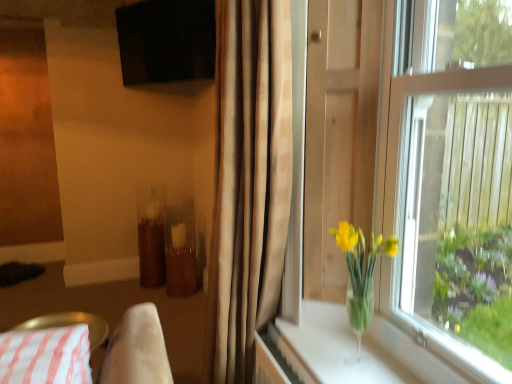
Question: Does black matte screen at upper center, which is the second window screen from bottom to top, have a greater height compared to translucent glass vase at window?

Choices:
 (A) yes
 (B) no

Answer: (A)

Question: From a real-world perspective, is black matte screen at upper center, arranged as the 1th window screen when viewed from the left, over translucent glass vase at window?

Choices:
 (A) no
 (B) yes

Answer: (B)

Question: Is black matte screen at upper center, arranged as the 1th window screen when viewed from the back, positioned with its back to translucent glass vase at window?

Choices:
 (A) no
 (B) yes

Answer: (A)

Question: Is black matte screen at upper center, the first window screen positioned from the top, thinner than translucent glass vase at window?

Choices:
 (A) no
 (B) yes

Answer: (B)

Question: Does black matte screen at upper center, the 2th window screen in the front-to-back sequence, have a greater width compared to translucent glass vase at window?

Choices:
 (A) yes
 (B) no

Answer: (B)

Question: From the image's perspective, does black matte screen at upper center, the 2th window screen in the front-to-back sequence, appear higher than translucent glass vase at window?

Choices:
 (A) no
 (B) yes

Answer: (B)

Question: Is white striped fabric at lower left oriented away from translucent glass vase at window?

Choices:
 (A) yes
 (B) no

Answer: (B)

Question: Is the depth of white striped fabric at lower left less than that of translucent glass vase at window?

Choices:
 (A) no
 (B) yes

Answer: (A)

Question: Would you say translucent glass vase at window is part of white striped fabric at lower left's contents?

Choices:
 (A) yes
 (B) no

Answer: (B)

Question: Is white striped fabric at lower left shorter than translucent glass vase at window?

Choices:
 (A) no
 (B) yes

Answer: (B)

Question: From the image's perspective, would you say white striped fabric at lower left is shown under translucent glass vase at window?

Choices:
 (A) yes
 (B) no

Answer: (A)

Question: Does white striped fabric at lower left appear on the right side of translucent glass vase at window?

Choices:
 (A) yes
 (B) no

Answer: (B)

Question: From the image's perspective, is black matte screen at upper center, arranged as the 1th window screen when viewed from the back, over white striped fabric at lower left?

Choices:
 (A) no
 (B) yes

Answer: (B)